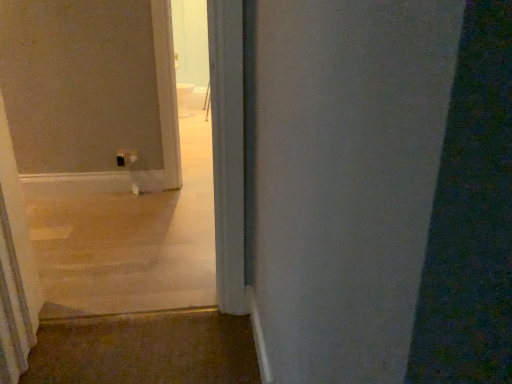
This screenshot has height=384, width=512. What do you see at coordinates (126, 157) in the screenshot? I see `black plastic electric outlet at lower center` at bounding box center [126, 157].

Image resolution: width=512 pixels, height=384 pixels. Identify the location of black plastic electric outlet at lower center. (126, 157).

In order to click on black plastic electric outlet at lower center in this screenshot , I will do pyautogui.click(x=126, y=157).